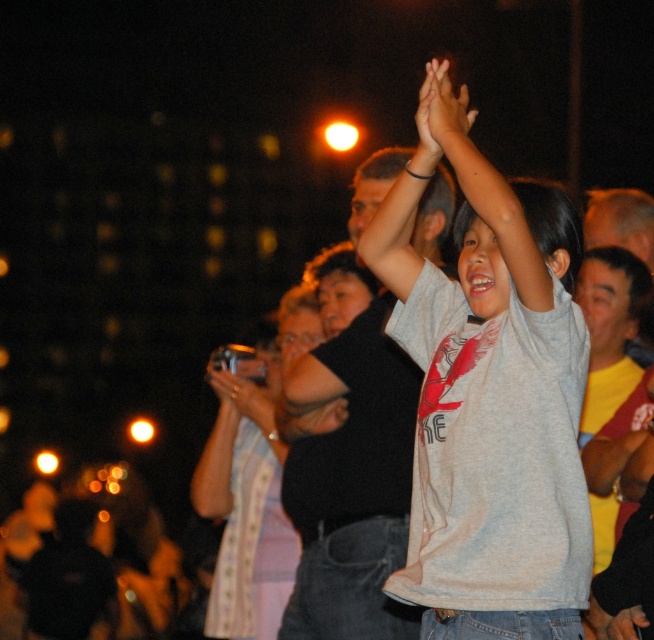
You are a photographer at the event and want to ensure the metallic silver camera at center is fully visible in the photo without being obscured by the gray matte shirt at center. Based on their sizes, is this possible?

The gray matte shirt at center is wider than the metallic silver camera at center, so there is a risk that the metallic silver camera at center could be partially obscured by the gray matte shirt at center if positioned too closely.

You are a photographer trying to capture the exact position of the smooth skin hands at upper center in the image. According to the coordinates provided, where should you focus your camera lens to ensure the hands are centered in the frame?

To center the smooth skin hands at upper center in the frame, focus the camera lens on the coordinates point at 0.184 on the x axis and 0.680 on the y axis, as the 2D location of smooth skin hands at upper center is at point (443, 116).